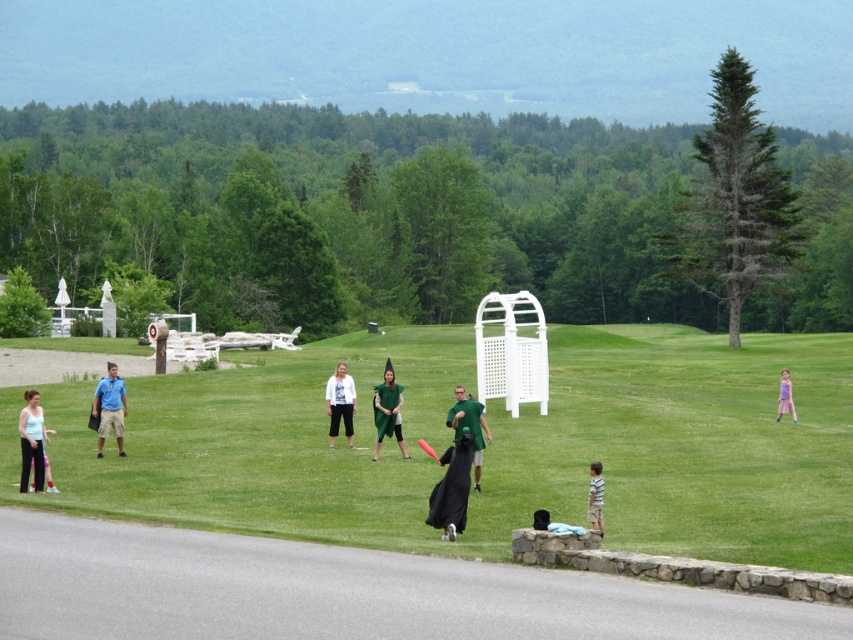
Question: Where is green matte dress at center located in relation to light blue striped shirt at lower right in the image?

Choices:
 (A) below
 (B) above

Answer: (B)

Question: Which object is positioned closest to the green matte wizard hat at center?

Choices:
 (A) green fabric dress at center
 (B) light blue striped shirt at lower right
 (C) green matte dress at center
 (D) black matte dress at center

Answer: (D)

Question: Among these objects, which one is farthest from the camera?

Choices:
 (A) matte blue shirt at left
 (B) black matte dress at center
 (C) purple satin dress at right
 (D) light blue striped shirt at lower right

Answer: (C)

Question: Which object is positioned closest to the green matte dress at center?

Choices:
 (A) matte white tank top at lower left
 (B) purple satin dress at right
 (C) black matte dress at center

Answer: (A)

Question: Observing the image, what is the correct spatial positioning of black matte dress at center in reference to light blue striped shirt at lower right?

Choices:
 (A) below
 (B) above

Answer: (B)

Question: Does black matte dress at center have a smaller size compared to matte blue shirt at left?

Choices:
 (A) yes
 (B) no

Answer: (A)